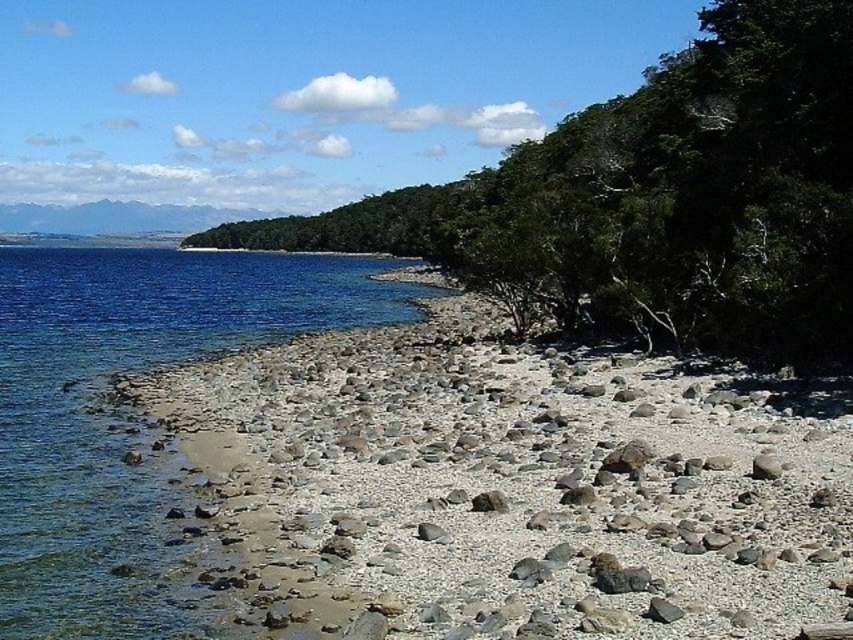
Question: Among these points, which one is farthest from the camera?

Choices:
 (A) (332, 307)
 (B) (428, 538)

Answer: (A)

Question: Is gray rock at lower center bigger than smooth gray rock at center?

Choices:
 (A) no
 (B) yes

Answer: (B)

Question: Does blue water at lower left lie behind gray rock at lower center?

Choices:
 (A) yes
 (B) no

Answer: (A)

Question: Is blue water at lower left positioned before smooth gray rock at center?

Choices:
 (A) yes
 (B) no

Answer: (A)

Question: Which is nearer to the blue water at lower left?

Choices:
 (A) green leafy tree at upper center
 (B) white gravel at lower left
 (C) gray rock at lower center
 (D) smooth gray rock at center

Answer: (B)

Question: Which of the following is the farthest from the observer?

Choices:
 (A) (112, 616)
 (B) (822, 540)

Answer: (B)